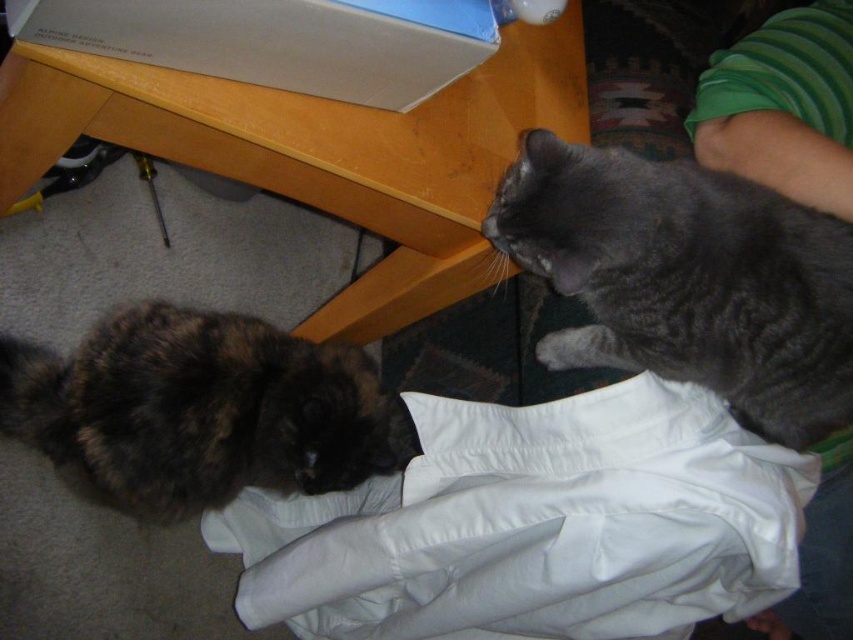
Which is in front, point (749, 449) or point (328, 449)?

Point (749, 449) is in front.

Where is `soft gray cat at lower right`? The image size is (853, 640). soft gray cat at lower right is located at coordinates (534, 525).

Between soft gray cat at lower right and gray fluffy cat at upper right, which one has more height?

Standing taller between the two is soft gray cat at lower right.

Can you confirm if soft gray cat at lower right is taller than gray fluffy cat at upper right?

Yes.

Image resolution: width=853 pixels, height=640 pixels. I want to click on soft gray cat at lower right, so click(534, 525).

Looking at this image, does gray fluffy cat at upper right come behind fluffy tortoiseshell cat at lower left?

No, gray fluffy cat at upper right is in front of fluffy tortoiseshell cat at lower left.

Which is above, gray fluffy cat at upper right or fluffy tortoiseshell cat at lower left?

gray fluffy cat at upper right is higher up.

Identify the location of gray fluffy cat at upper right. (688, 280).